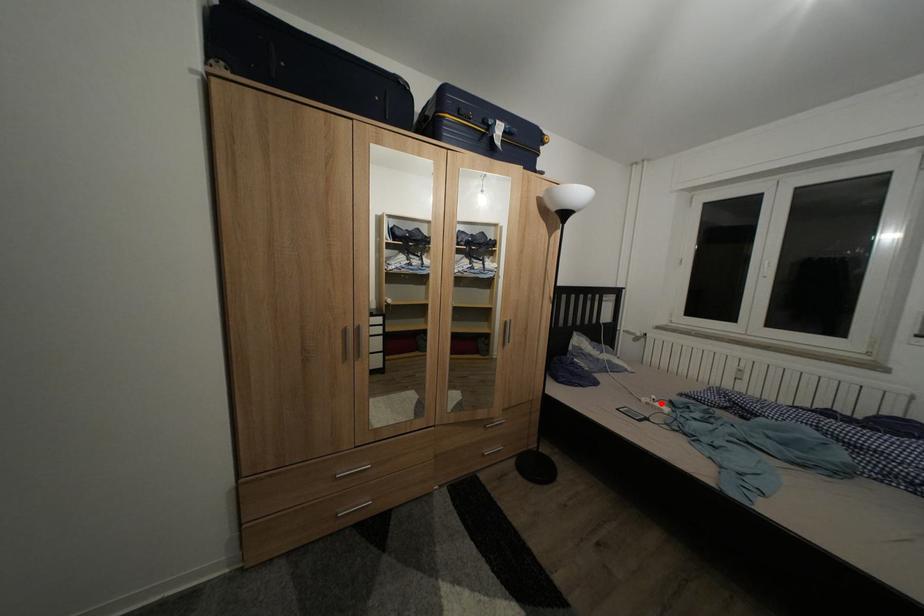
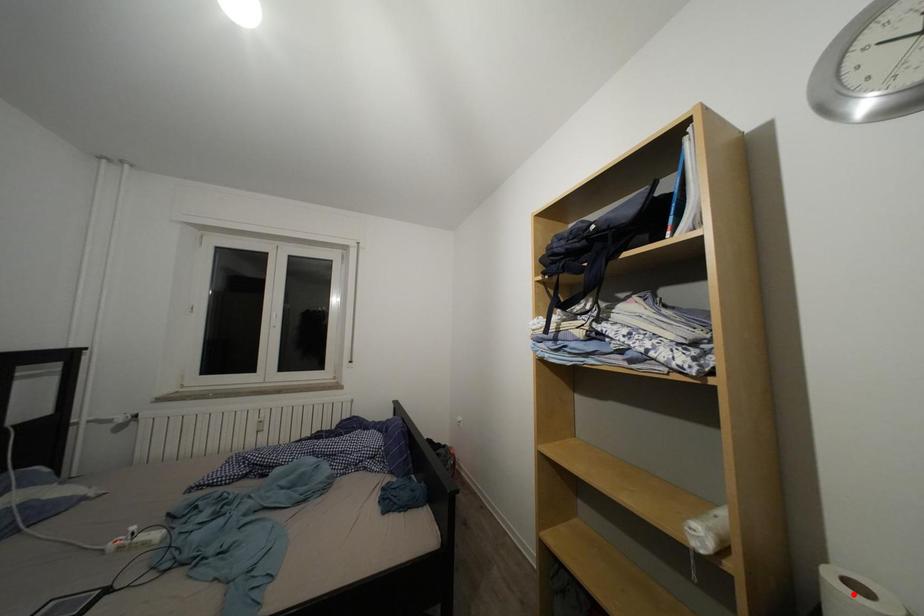
I am providing you with two images of the same scene from different viewpoints. A red point is marked on the first image and another point is marked on the second image. Is the marked point in image1 the same physical position as the marked point in image2?

No